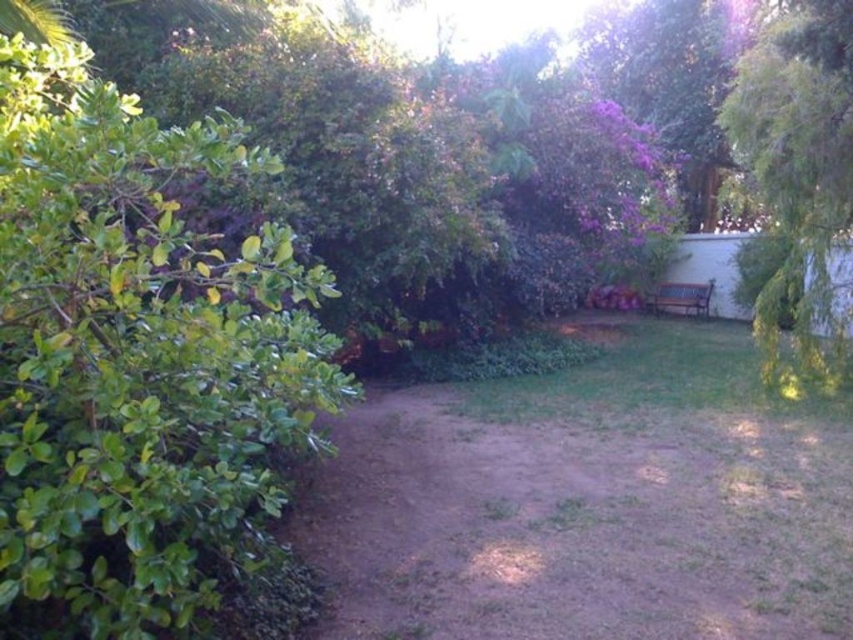
Consider the image. You are standing at the point labeled as point (138, 358) in the garden. Which object is directly in front of you?

The green leafy bush at left is directly in front of you at point (138, 358).